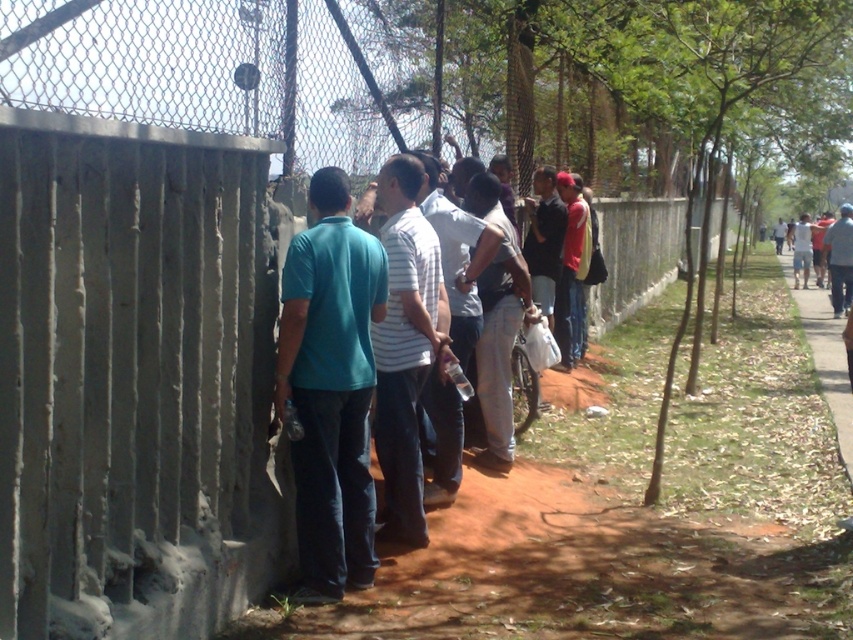
Question: Which point is farther to the camera?

Choices:
 (A) white striped shirt at center
 (B) teal matte shirt at center

Answer: (A)

Question: Among these objects, which one is nearest to the camera?

Choices:
 (A) matte red shirt at center
 (B) white striped shirt at center
 (C) teal matte shirt at center

Answer: (C)

Question: In this image, where is teal matte shirt at center located relative to white striped shirt at center?

Choices:
 (A) right
 (B) left

Answer: (B)

Question: Observing the image, what is the correct spatial positioning of white striped shirt at center in reference to matte red shirt at center?

Choices:
 (A) below
 (B) above

Answer: (A)

Question: Does white striped shirt at center appear on the left side of matte red shirt at center?

Choices:
 (A) yes
 (B) no

Answer: (A)

Question: Which of the following is the farthest from the observer?

Choices:
 (A) white striped shirt at center
 (B) teal matte shirt at center
 (C) matte red shirt at center

Answer: (C)